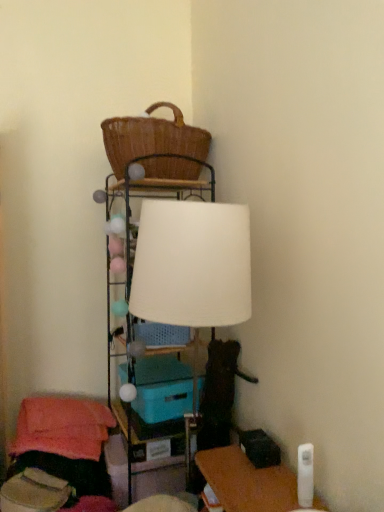
Question: Is matte plastic table at center taller or shorter than teal plastic storage box at center?

Choices:
 (A) tall
 (B) short

Answer: (A)

Question: Looking at their shapes, would you say matte plastic table at center is wider or thinner than teal plastic storage box at center?

Choices:
 (A) wide
 (B) thin

Answer: (A)

Question: Considering the real-world distances, which object is farthest from the woven brown basket at upper center?

Choices:
 (A) white fabric lampshade at upper center
 (B) white matte lampshade at center
 (C) matte plastic table at center
 (D) teal plastic storage box at center

Answer: (C)

Question: Which of these objects is positioned farthest from the matte plastic table at center?

Choices:
 (A) woven brown basket at upper center
 (B) white fabric lampshade at upper center
 (C) white matte lampshade at center
 (D) teal plastic storage box at center

Answer: (A)